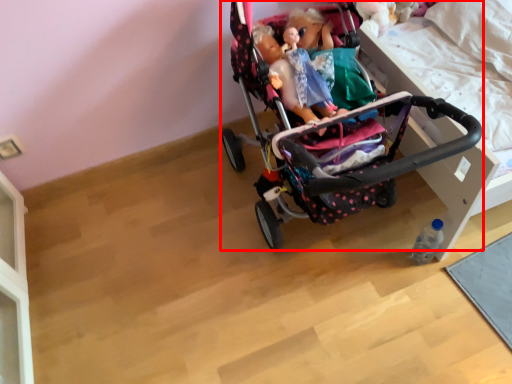
Question: In this image, where is stroller (annotated by the red box) located relative to bottle?

Choices:
 (A) left
 (B) right

Answer: (A)